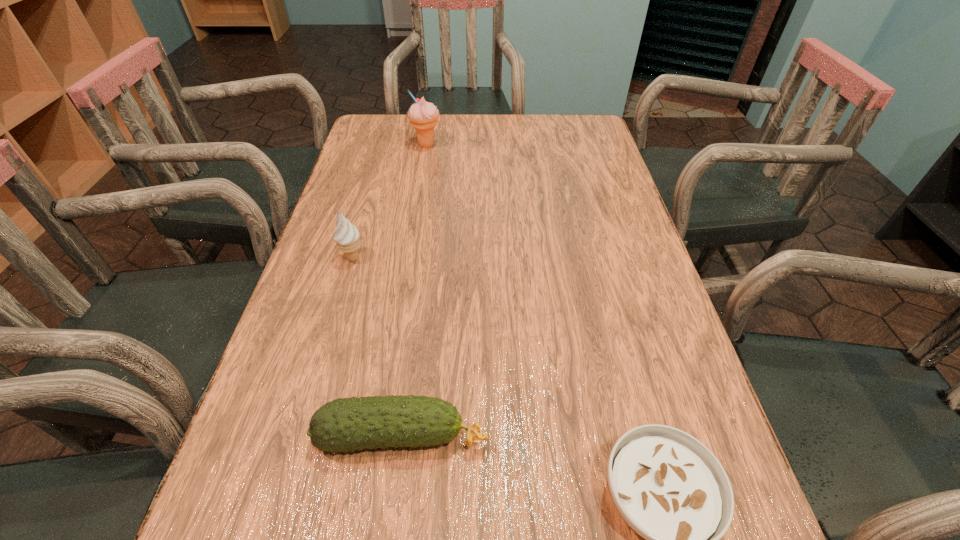
Identify the location of the right icecream. This screenshot has width=960, height=540. (x=423, y=116).

You are a GUI agent. You are given a task and a screenshot of the screen. Output one action in this format:
    pyautogui.click(x=<x>, y=<y>)
    Task: Click on the taller icecream
    
    Given the screenshot: What is the action you would take?
    pyautogui.click(x=423, y=116)

At what (x,y) coordinates should I click in order to perform the action: click on the nearer icecream. Please return your answer as a coordinate pair (x, y). The image size is (960, 540). Looking at the image, I should click on (347, 235).

Image resolution: width=960 pixels, height=540 pixels. In order to click on the left icecream in this screenshot , I will do `click(347, 235)`.

Identify the location of cucumber. The width and height of the screenshot is (960, 540). (349, 424).

What are the coordinates of `free space located on the front of the farther icecream` in the screenshot? It's located at (413, 228).

Image resolution: width=960 pixels, height=540 pixels. I want to click on vacant space situated 0.370m on the front-facing side of the shorter icecream, so click(x=304, y=426).

Locate an element on the screen. The height and width of the screenshot is (540, 960). vacant space located at the blossom end of the cucumber is located at coordinates (582, 436).

This screenshot has height=540, width=960. I want to click on object that is at the far edge, so click(x=423, y=116).

This screenshot has height=540, width=960. Find the location of `icecream at the left edge`. icecream at the left edge is located at coordinates (347, 235).